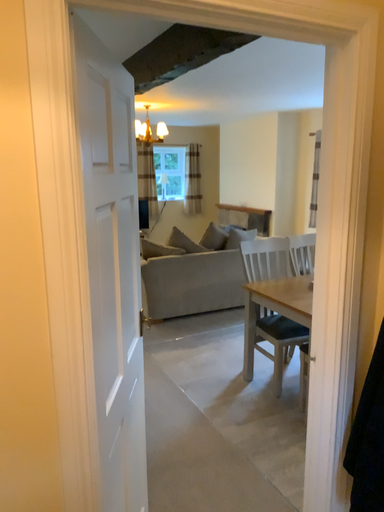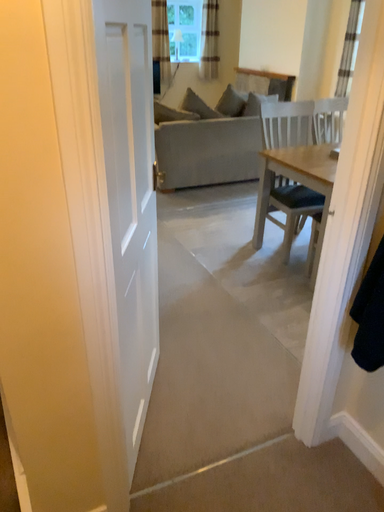
Question: Which way did the camera rotate in the video?

Choices:
 (A) rotated upward
 (B) rotated downward

Answer: (B)